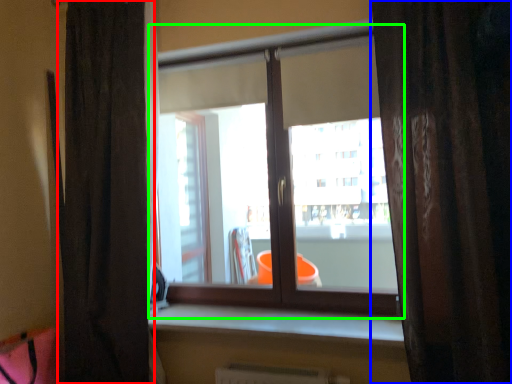
Question: Which is farther away from curtain (highlighted by a red box)? curtain (highlighted by a blue box) or window (highlighted by a green box)?

Choices:
 (A) curtain
 (B) window

Answer: (A)